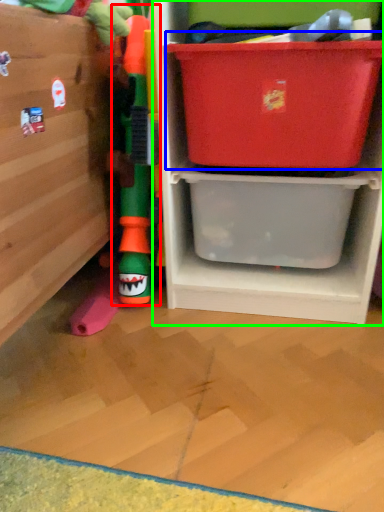
Question: Which object is the farthest from toy (highlighted by a red box)? Choose among these: storage box (highlighted by a blue box) or shelf (highlighted by a green box).

Choices:
 (A) storage box
 (B) shelf

Answer: (A)